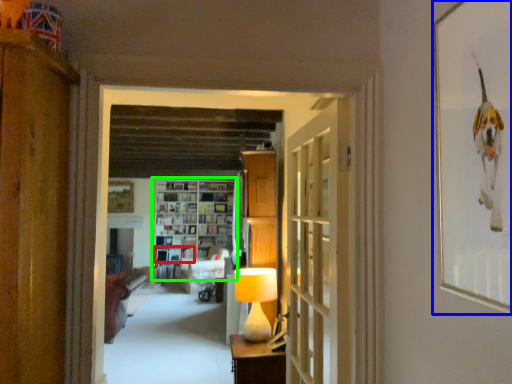
Question: Based on their relative distances, which object is farther from book (highlighted by a red box)? Choose from picture frame (highlighted by a blue box) and shelf (highlighted by a green box).

Choices:
 (A) picture frame
 (B) shelf

Answer: (A)